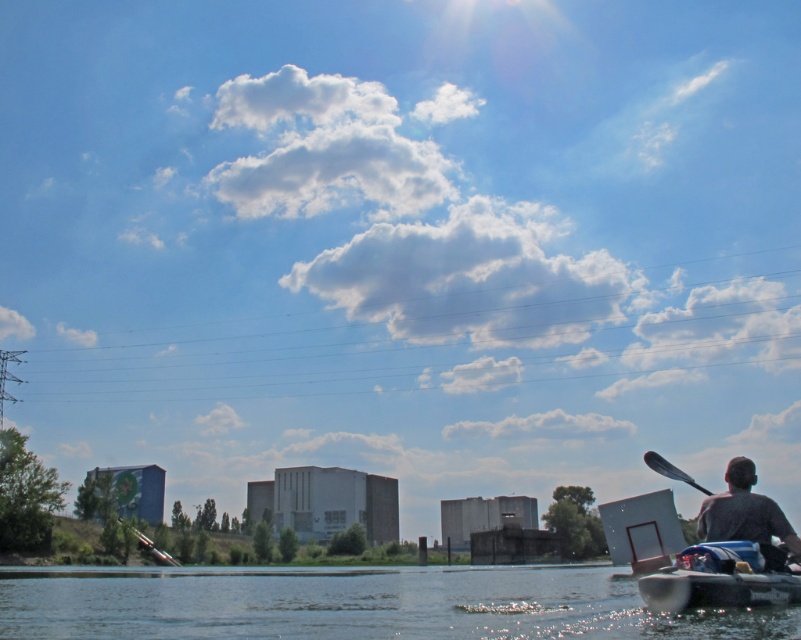
Question: Which of these objects is positioned farthest from the dark gray fabric at lower right?

Choices:
 (A) black plastic paddle at lower right
 (B) white plastic boat at lower right
 (C) clear water at lower center

Answer: (C)

Question: Considering the real-world distances, which object is farthest from the black plastic paddle at lower right?

Choices:
 (A) clear water at lower center
 (B) white plastic boat at lower right
 (C) dark gray fabric at lower right

Answer: (C)

Question: Is white plastic boat at lower right thinner than black plastic paddle at lower right?

Choices:
 (A) no
 (B) yes

Answer: (B)

Question: Can you confirm if dark gray fabric at lower right is positioned to the left of black plastic paddle at lower right?

Choices:
 (A) no
 (B) yes

Answer: (B)

Question: Which object is positioned closest to the dark gray fabric at lower right?

Choices:
 (A) black plastic paddle at lower right
 (B) white plastic boat at lower right

Answer: (B)

Question: From the image, what is the correct spatial relationship of white plastic boat at lower right in relation to black plastic paddle at lower right?

Choices:
 (A) above
 (B) below

Answer: (A)